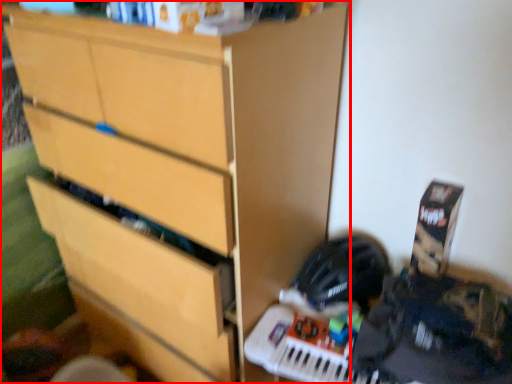
Question: From the image's perspective, what is the correct spatial positioning of chest of drawers (annotated by the red box) in reference to helmet?

Choices:
 (A) below
 (B) above

Answer: (B)